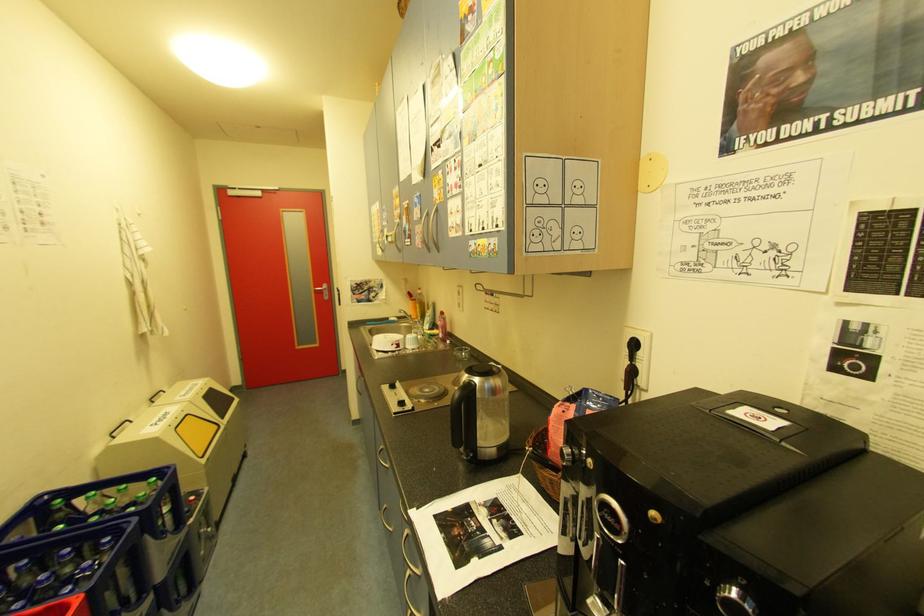
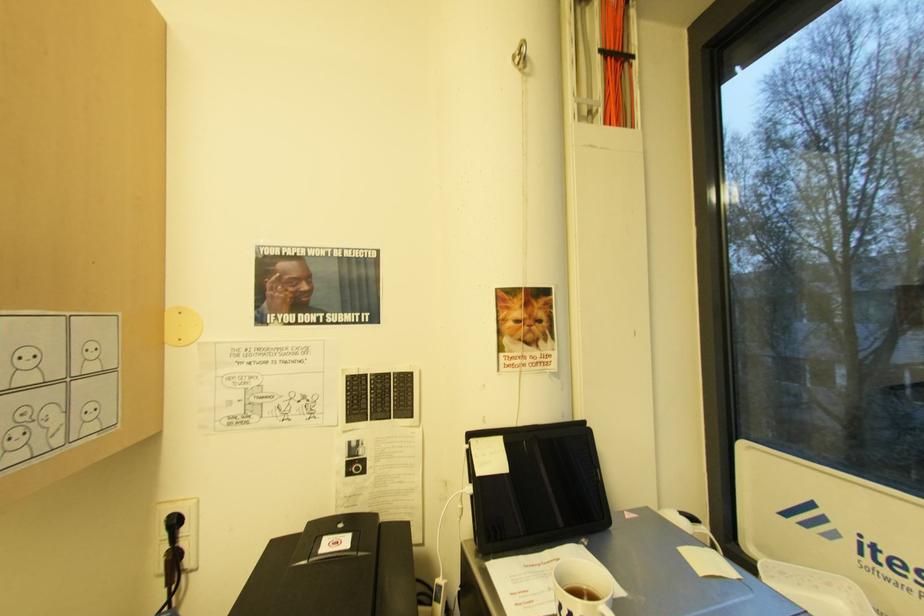
Question: The first image is from the beginning of the video and the second image is from the end. How did the camera likely rotate when shooting the video?

Choices:
 (A) Left
 (B) Right
 (C) Up
 (D) Down

Answer: (B)